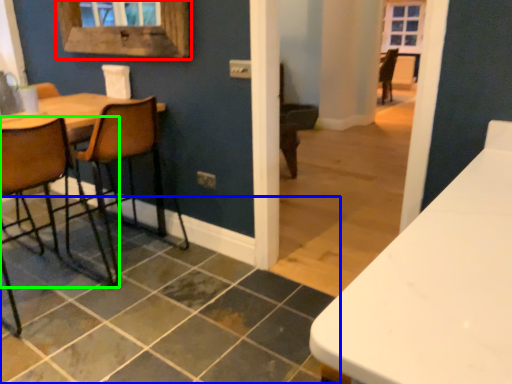
Question: Which object is the closest to the window frame (highlighted by a red box)? Choose among these: tile (highlighted by a blue box) or chair (highlighted by a green box).

Choices:
 (A) tile
 (B) chair

Answer: (B)